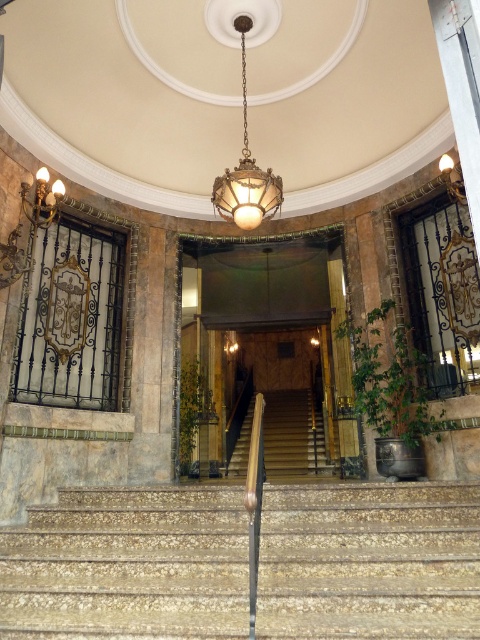
Question: Does wooden staircase at center have a smaller size compared to metallic brass lamp at upper right?

Choices:
 (A) yes
 (B) no

Answer: (B)

Question: Does stone textured stairs at center have a greater width compared to matte brass chandelier at center?

Choices:
 (A) no
 (B) yes

Answer: (B)

Question: Among these points, which one is nearest to the camera?

Choices:
 (A) (110, 616)
 (B) (302, 461)

Answer: (A)

Question: Which object is closer to the camera taking this photo?

Choices:
 (A) matte brass chandelier at center
 (B) stone textured stairs at center

Answer: (B)

Question: Does matte brass chandelier at center have a smaller size compared to metallic brass lamp at upper right?

Choices:
 (A) no
 (B) yes

Answer: (A)

Question: Which object is the closest to the stone textured stairs at center?

Choices:
 (A) wooden paneling at center
 (B) matte brass chandelier at center
 (C) metallic brass lamp at upper right
 (D) wooden staircase at center

Answer: (B)